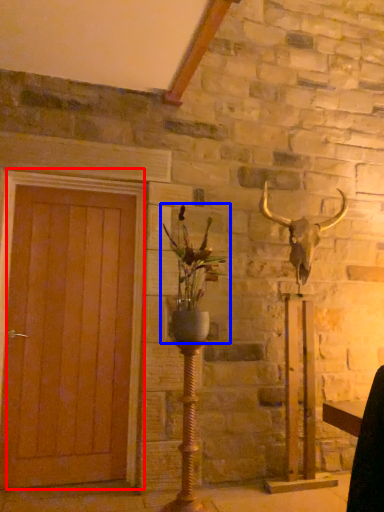
Question: Among these objects, which one is farthest to the camera, door (highlighted by a red box) or houseplant (highlighted by a blue box)?

Choices:
 (A) door
 (B) houseplant

Answer: (A)